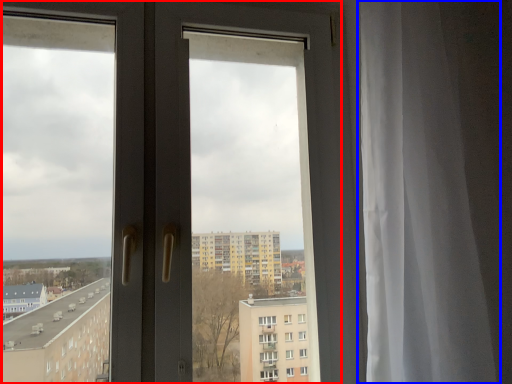
Question: Among these objects, which one is farthest to the camera, door (highlighted by a red box) or curtain (highlighted by a blue box)?

Choices:
 (A) door
 (B) curtain

Answer: (A)